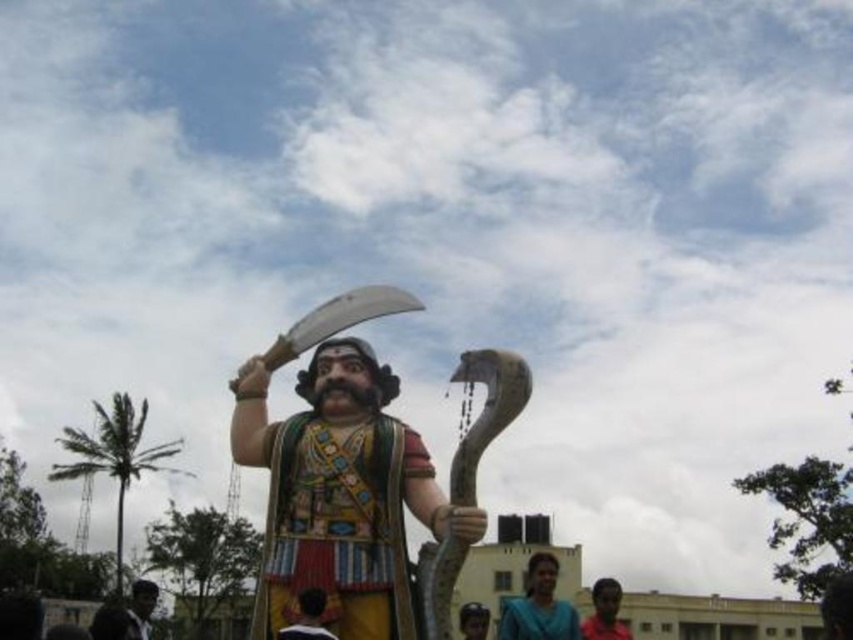
This screenshot has height=640, width=853. What do you see at coordinates (605, 612) in the screenshot?
I see `dark skin human at lower right` at bounding box center [605, 612].

Who is lower down, dark skin human at lower right or smooth brown hair at center?

dark skin human at lower right is below.

You are a GUI agent. You are given a task and a screenshot of the screen. Output one action in this format:
    pyautogui.click(x=<x>, y=<y>)
    Task: Click on the dark skin human at lower right
    The width and height of the screenshot is (853, 640).
    Given the screenshot: What is the action you would take?
    pyautogui.click(x=605, y=612)

The width and height of the screenshot is (853, 640). What are the coordinates of `dark skin human at lower right` in the screenshot? It's located at (605, 612).

Can you confirm if blue fabric saree at lower center is smaller than dark skin human at lower right?

Yes, blue fabric saree at lower center is smaller than dark skin human at lower right.

Can you confirm if blue fabric saree at lower center is positioned to the left of dark skin human at lower right?

Yes, blue fabric saree at lower center is to the left of dark skin human at lower right.

Is point (527, 598) farther from camera compared to point (614, 605)?

That is False.

Where is `blue fabric saree at lower center`? The width and height of the screenshot is (853, 640). blue fabric saree at lower center is located at coordinates (538, 605).

Can you confirm if shiny silver ax at upper center is positioned to the left of blue fabric saree at lower center?

Indeed, shiny silver ax at upper center is positioned on the left side of blue fabric saree at lower center.

Is shiny silver ax at upper center shorter than blue fabric saree at lower center?

Yes, shiny silver ax at upper center is shorter than blue fabric saree at lower center.

Which is behind, point (346, 324) or point (566, 636)?

Positioned behind is point (566, 636).

In order to click on shiny silver ax at upper center in this screenshot , I will do `click(337, 320)`.